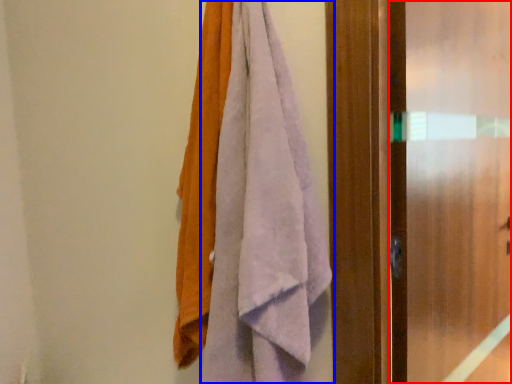
Question: Among these objects, which one is nearest to the camera, screen door (highlighted by a red box) or towel (highlighted by a blue box)?

Choices:
 (A) screen door
 (B) towel

Answer: (B)